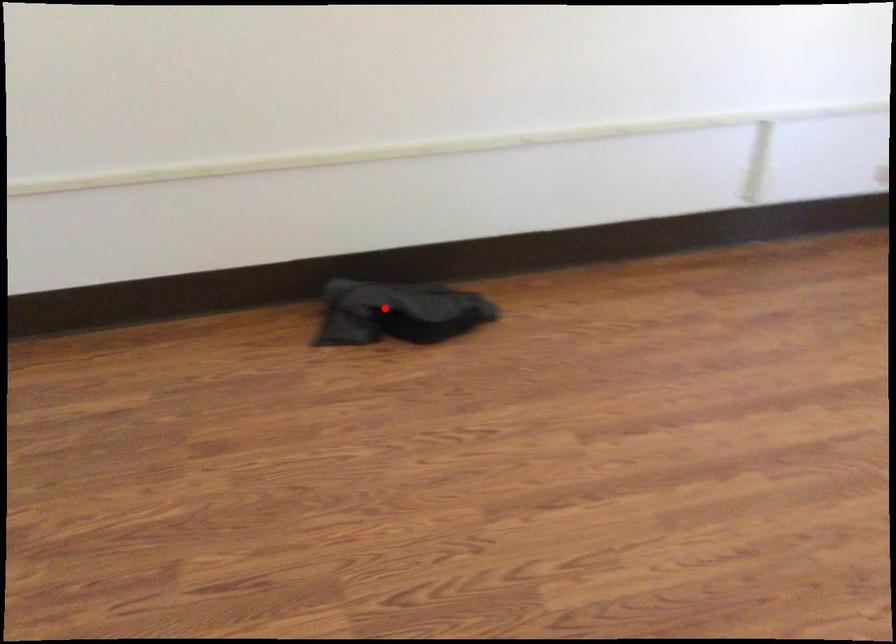
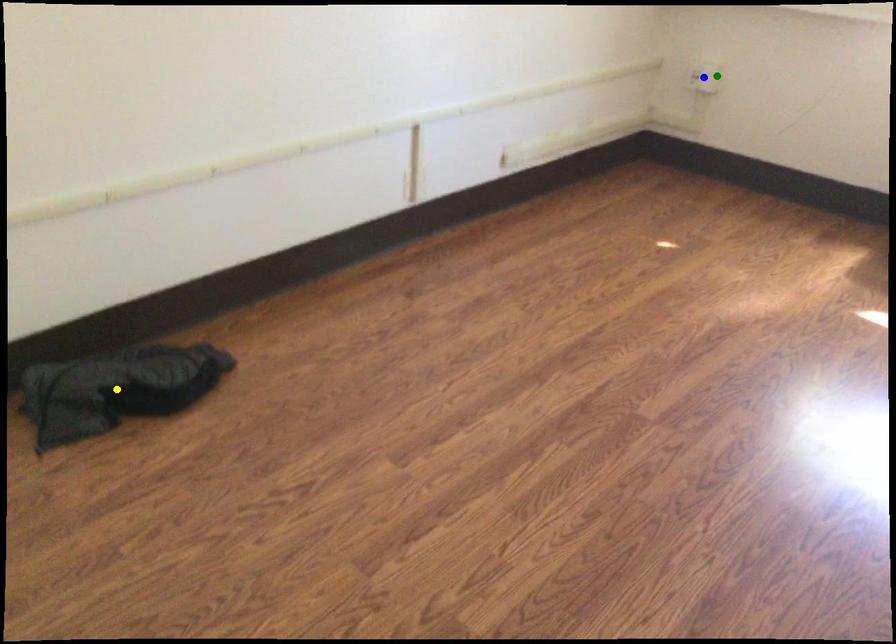
Question: I am providing you with two images of the same scene from different viewpoints. A red point is marked on the first image. You are given multiple points on the second image. In image 2, which mark is for the same physical point as the one in image 1?

Choices:
 (A) yellow point
 (B) green point
 (C) blue point

Answer: (A)